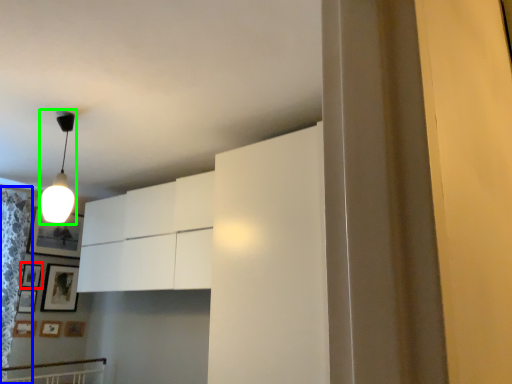
Question: Which object is the closest to the picture frame (highlighted by a red box)? Choose among these: curtain (highlighted by a blue box) or lamp (highlighted by a green box).

Choices:
 (A) curtain
 (B) lamp

Answer: (A)